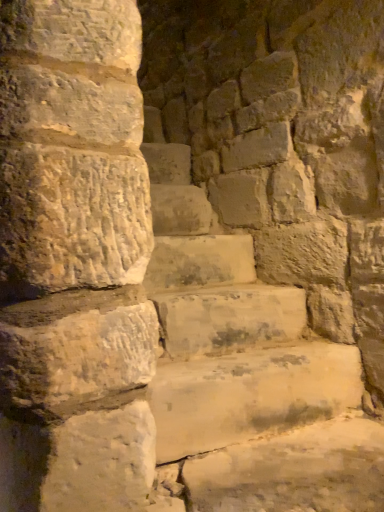
At what (x,y) coordinates should I click in order to perform the action: click on smooth stone brick at left. Please return your answer as a coordinate pair (x, y). This screenshot has width=384, height=512. Looking at the image, I should click on (77, 358).

Looking at this image, measure the distance between point [94,391] and camera.

A distance of 89.40 centimeters exists between point [94,391] and camera.

What do you see at coordinates (77, 358) in the screenshot? I see `smooth stone brick at left` at bounding box center [77, 358].

Find the location of a particular element. smooth stone brick at left is located at coordinates coord(77,358).